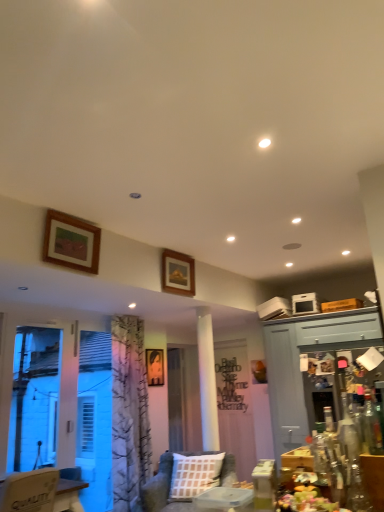
Question: Does wooden picture frame at upper center, placed as the 2th picture frame when sorted from top to bottom, have a greater height compared to white plastic screen door at lower left, positioned as the fourth screen door in back-to-front order?

Choices:
 (A) no
 (B) yes

Answer: (A)

Question: Is wooden picture frame at upper center, placed as the 2th picture frame when sorted from top to bottom, wider than white plastic screen door at lower left, which appears as the 1th screen door when viewed from the left?

Choices:
 (A) yes
 (B) no

Answer: (B)

Question: Could you tell me if wooden picture frame at upper center, the 1th picture frame from the right, is facing white plastic screen door at lower left, marked as the 1th screen door in a front-to-back arrangement?

Choices:
 (A) no
 (B) yes

Answer: (A)

Question: From a real-world perspective, is wooden picture frame at upper center, the second picture frame when ordered from back to front, on white plastic screen door at lower left, positioned as the fourth screen door in back-to-front order?

Choices:
 (A) no
 (B) yes

Answer: (B)

Question: From the image's perspective, is wooden picture frame at upper center, the 1th picture frame from the right, under white plastic screen door at lower left, positioned as the fourth screen door in back-to-front order?

Choices:
 (A) yes
 (B) no

Answer: (B)

Question: Does wooden picture frame at upper center, which appears as the 3th picture frame when viewed from the left, appear on the left side of white plastic screen door at lower left, which appears as the 1th screen door when viewed from the left?

Choices:
 (A) yes
 (B) no

Answer: (B)

Question: Considering the relative positions of metallic silver screen door at right, marked as the 1th screen door in a right-to-left arrangement, and textured beige couch at center in the image provided, is metallic silver screen door at right, marked as the 1th screen door in a right-to-left arrangement, behind textured beige couch at center?

Choices:
 (A) no
 (B) yes

Answer: (B)

Question: Considering the relative sizes of metallic silver screen door at right, the third screen door from the back, and textured beige couch at center in the image provided, is metallic silver screen door at right, the third screen door from the back, wider than textured beige couch at center?

Choices:
 (A) yes
 (B) no

Answer: (B)

Question: Does metallic silver screen door at right, the third screen door from the back, have a larger size compared to textured beige couch at center?

Choices:
 (A) yes
 (B) no

Answer: (B)

Question: Is metallic silver screen door at right, marked as the 1th screen door in a right-to-left arrangement, oriented towards textured beige couch at center?

Choices:
 (A) yes
 (B) no

Answer: (B)

Question: Would you say metallic silver screen door at right, which appears as the 2th screen door when viewed from the front, contains textured beige couch at center?

Choices:
 (A) no
 (B) yes

Answer: (A)

Question: From a real-world perspective, is metallic silver screen door at right, the 4th screen door from the left, physically above textured beige couch at center?

Choices:
 (A) yes
 (B) no

Answer: (A)

Question: Is wooden picture frame at upper center, the 2th picture frame positioned from the front, not within transparent glass bottle at lower right?

Choices:
 (A) no
 (B) yes

Answer: (B)